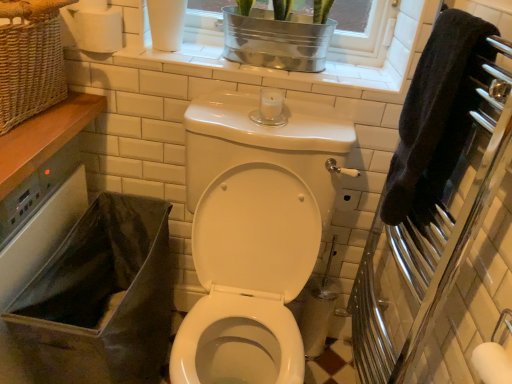
Question: Is white tile window frame at upper center, the 2th window frame from the right, in front of or behind polished chrome towel rack at right in the image?

Choices:
 (A) behind
 (B) front

Answer: (A)

Question: From the image's perspective, is white tile window frame at upper center, the first window frame when ordered from left to right, above or below polished chrome towel rack at right?

Choices:
 (A) above
 (B) below

Answer: (A)

Question: Which of these objects is positioned closest to the woven wicker basket at upper left?

Choices:
 (A) white glossy toilet at center
 (B) metallic silver window frame at upper center, marked as the second window frame in a left-to-right arrangement
 (C) black fabric laundry basket at lower left
 (D) black terry cloth towel at right
 (E) white matte toilet paper at upper left

Answer: (E)

Question: Estimate the real-world distances between objects in this image. Which object is farther from the polished chrome towel rack at right?

Choices:
 (A) white matte toilet paper at upper left
 (B) white tile window frame at upper center, the first window frame when ordered from left to right
 (C) black fabric laundry basket at lower left
 (D) white glossy toilet at center
 (E) metallic silver window frame at upper center, marked as the second window frame in a left-to-right arrangement

Answer: (A)